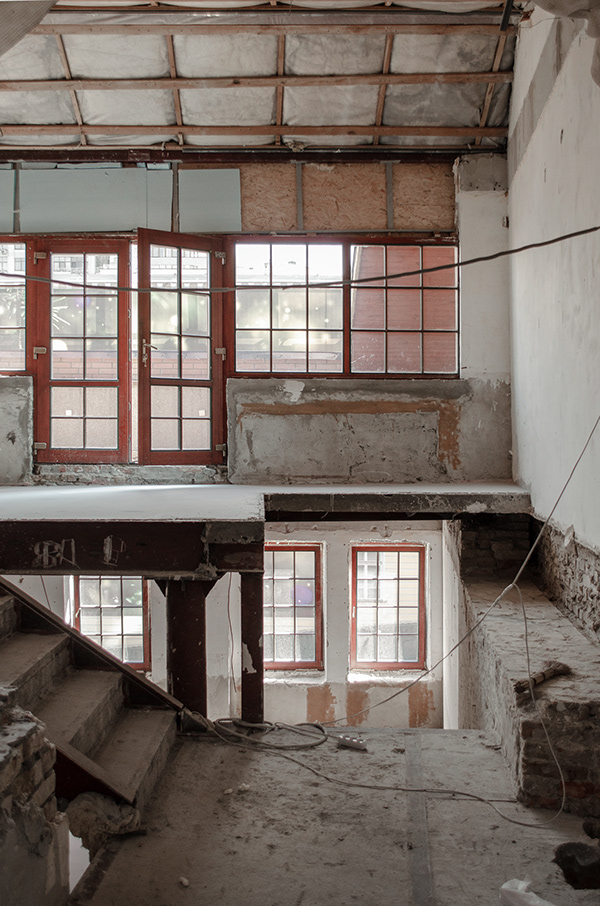
This screenshot has height=906, width=600. Find the location of `door handle`. door handle is located at coordinates (146, 342).